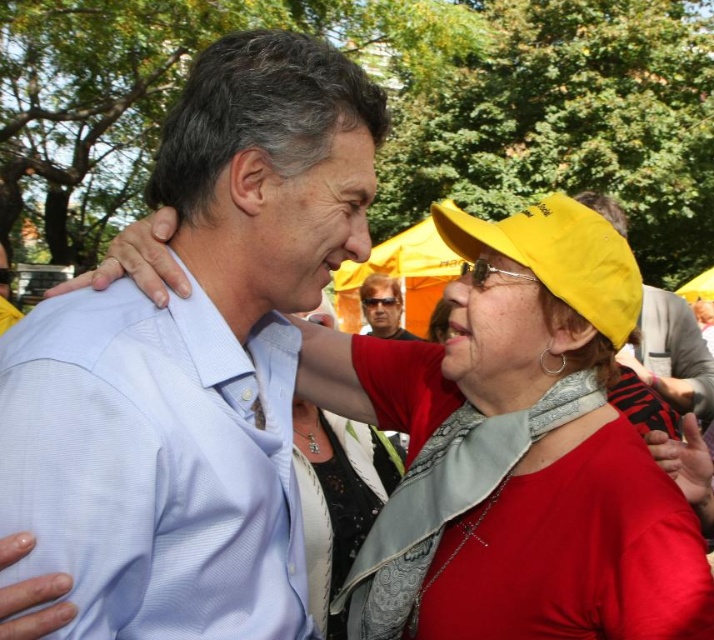
Question: Which object appears closest to the camera in this image?

Choices:
 (A) matte black sunglasses at center
 (B) matte yellow hat at upper right

Answer: (B)

Question: Considering the real-world distances, which object is farthest from the matte yellow hat at upper right?

Choices:
 (A) light blue shirt at center
 (B) matte black sunglasses at center

Answer: (B)

Question: Does light blue shirt at center lie behind matte black sunglasses at center?

Choices:
 (A) no
 (B) yes

Answer: (A)

Question: From the image, what is the correct spatial relationship of light blue shirt at center in relation to matte black sunglasses at center?

Choices:
 (A) below
 (B) above

Answer: (A)

Question: Can you confirm if light blue shirt at center is wider than matte black sunglasses at center?

Choices:
 (A) yes
 (B) no

Answer: (A)

Question: Based on their relative distances, which object is nearer to the matte yellow hat at upper right?

Choices:
 (A) light blue shirt at center
 (B) matte black sunglasses at center

Answer: (A)